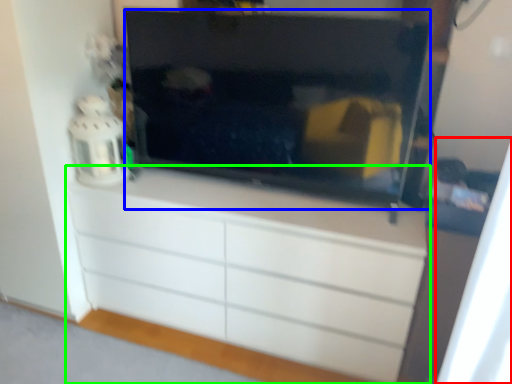
Question: Considering the real-world distances, which object is closest to curtain (highlighted by a red box)? television (highlighted by a blue box) or chest of drawers (highlighted by a green box).

Choices:
 (A) television
 (B) chest of drawers

Answer: (B)